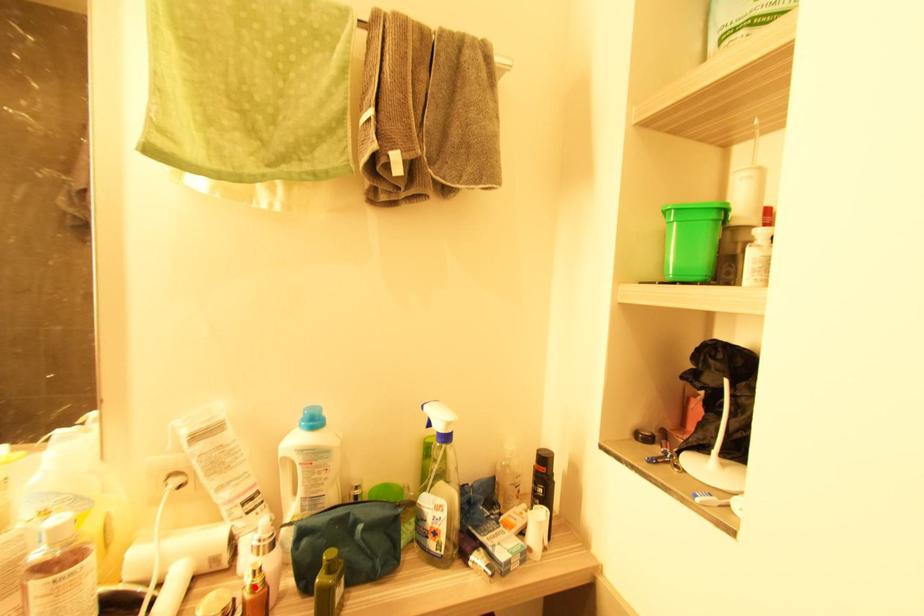
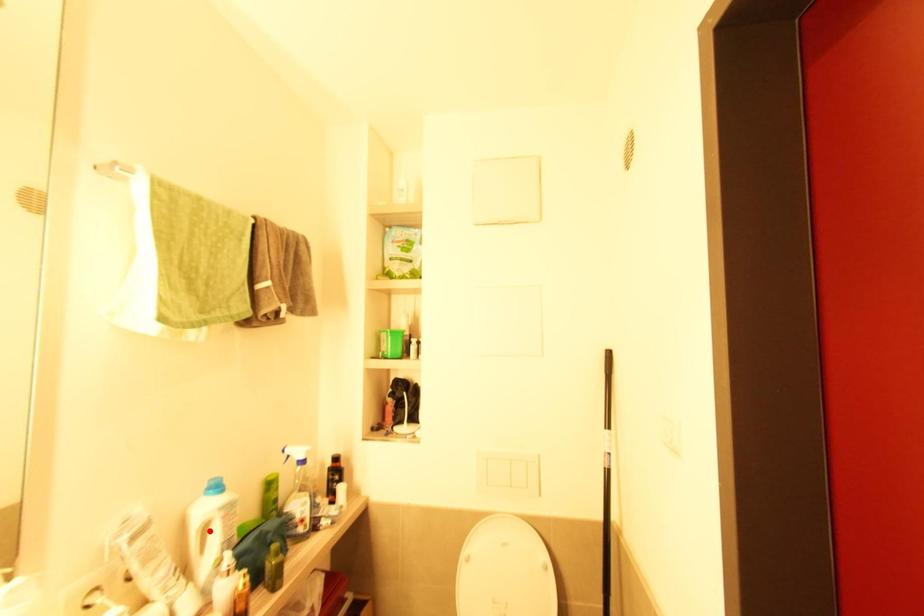
I am providing you with two images of the same scene from different viewpoints. A red point is marked on the first image and another point is marked on the second image. Are the points marked in image1 and image2 representing the same 3D position?

No